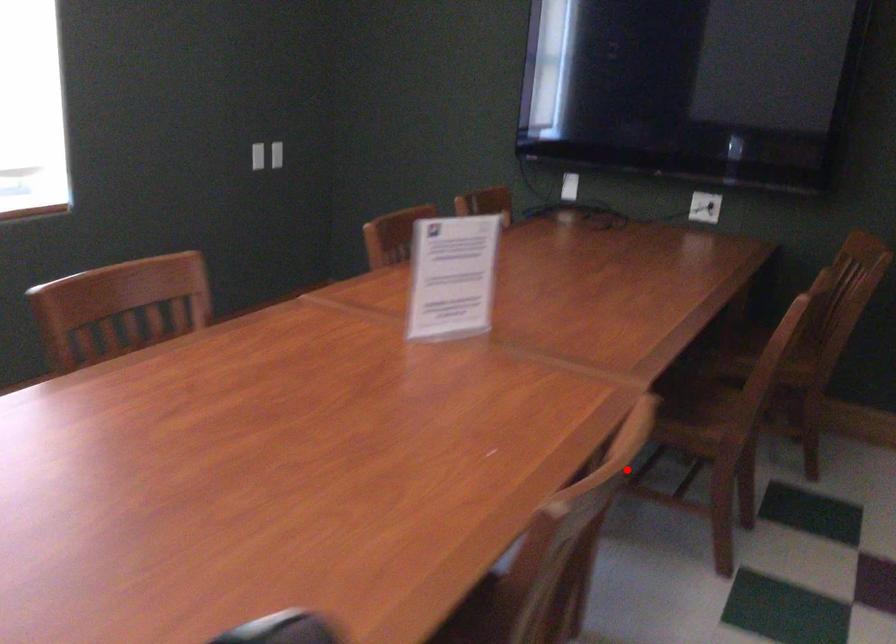
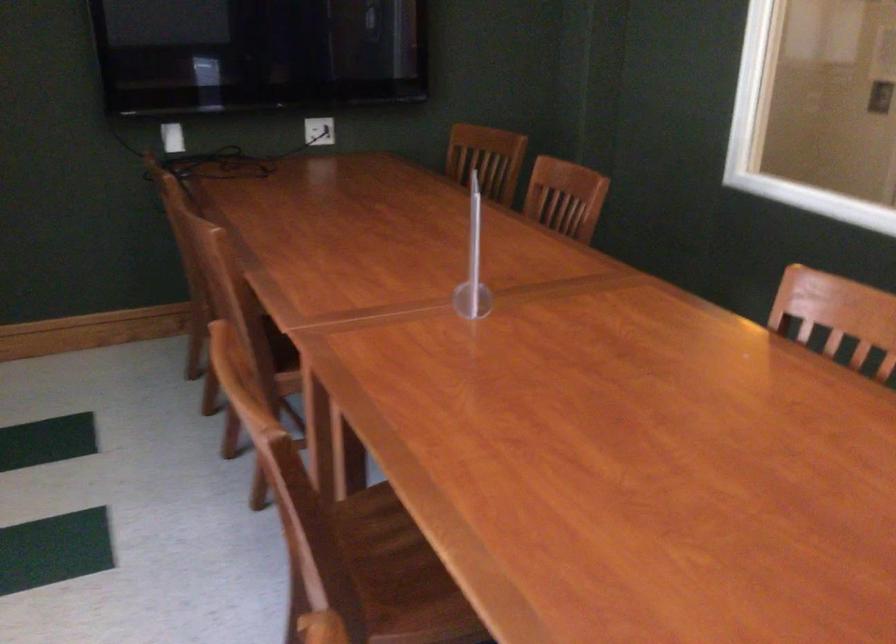
Find the pixel in the second image that matches the highlighted location in the first image.

(841, 313)